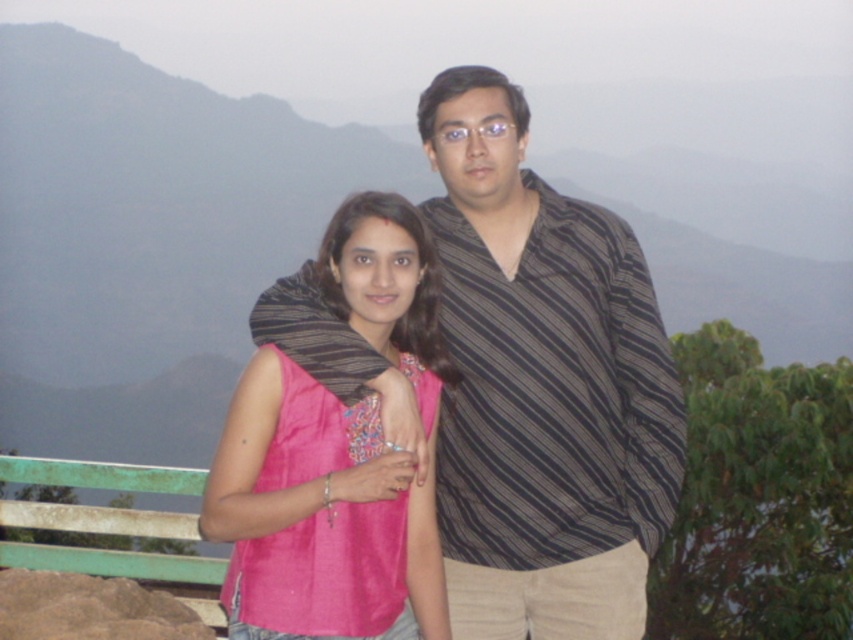
Question: In this image, where is striped fabric shirt at center located relative to pink fabric at center?

Choices:
 (A) below
 (B) above

Answer: (B)

Question: Among these objects, which one is nearest to the camera?

Choices:
 (A) striped fabric shirt at center
 (B) pink fabric at center

Answer: (B)

Question: Which point is farther to the camera?

Choices:
 (A) pink fabric at center
 (B) striped fabric shirt at center

Answer: (B)

Question: Where is striped fabric shirt at center located in relation to pink fabric at center in the image?

Choices:
 (A) above
 (B) below

Answer: (A)

Question: Can you confirm if striped fabric shirt at center is bigger than pink fabric at center?

Choices:
 (A) yes
 (B) no

Answer: (A)

Question: Which object appears closest to the camera in this image?

Choices:
 (A) pink fabric at center
 (B) striped fabric shirt at center

Answer: (A)